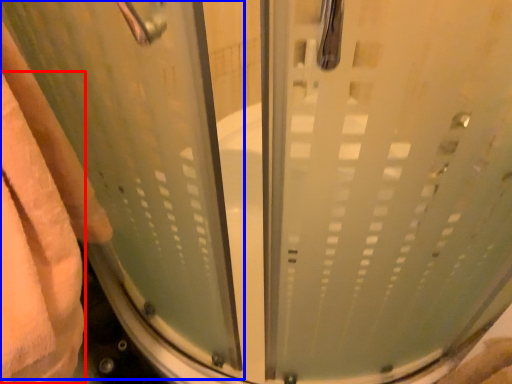
Question: Which object is further to the camera taking this photo, bath towel (highlighted by a red box) or screen door (highlighted by a blue box)?

Choices:
 (A) bath towel
 (B) screen door

Answer: (A)